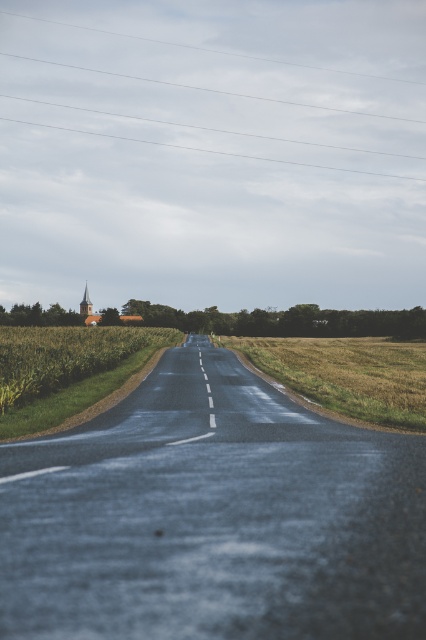
Question: Among these objects, which one is nearest to the camera?

Choices:
 (A) golden grassy field at center
 (B) green grassy corn field at left

Answer: (A)

Question: Is golden grassy field at center to the left of green grassy corn field at left from the viewer's perspective?

Choices:
 (A) yes
 (B) no

Answer: (B)

Question: Is golden grassy field at center bigger than green grassy corn field at left?

Choices:
 (A) yes
 (B) no

Answer: (A)

Question: From the image, what is the correct spatial relationship of golden grassy field at center in relation to green grassy corn field at left?

Choices:
 (A) left
 (B) right

Answer: (B)

Question: Among these points, which one is farthest from the camera?

Choices:
 (A) (13, 362)
 (B) (253, 339)

Answer: (B)